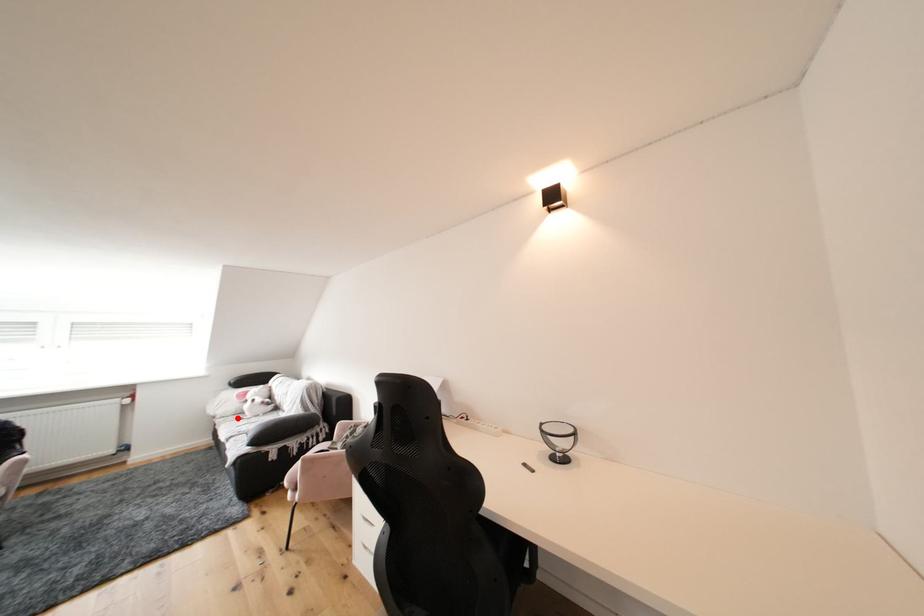
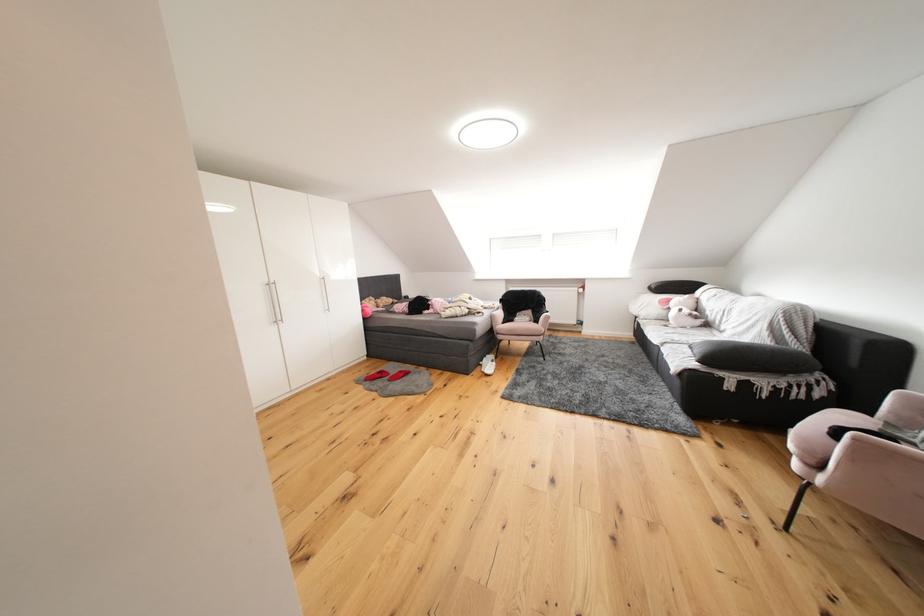
Question: I am providing you with two images of the same scene from different viewpoints. A red point is shown in image1. For the corresponding object point in image2, is it positioned nearer or farther from the camera?

Choices:
 (A) Nearer
 (B) Farther

Answer: (A)